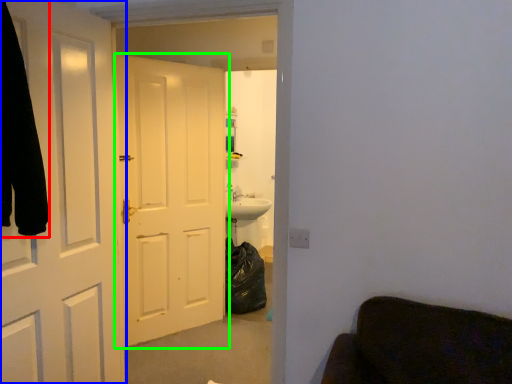
Question: Which object is the closest to the robe (highlighted by a red box)? Choose among these: door (highlighted by a blue box) or door (highlighted by a green box).

Choices:
 (A) door
 (B) door

Answer: (A)